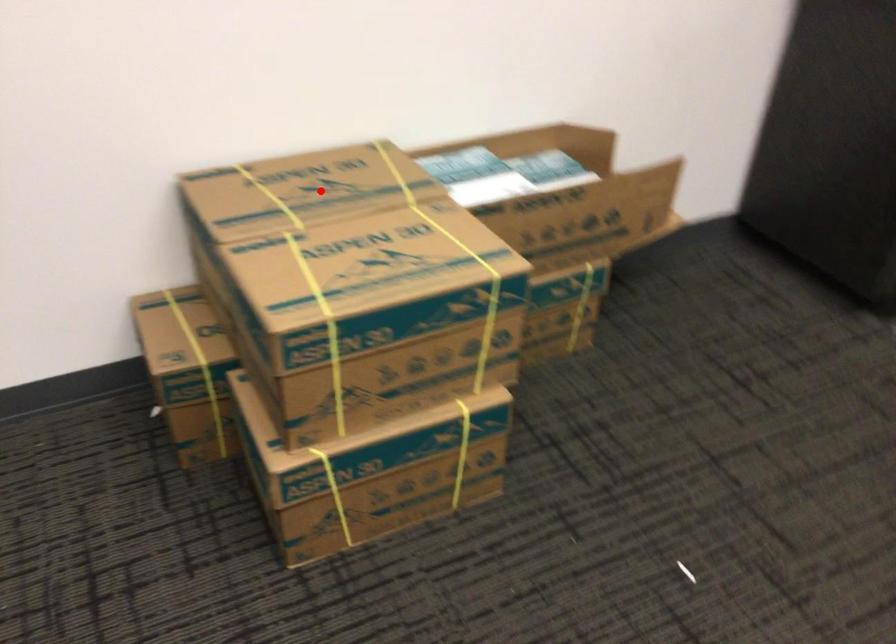
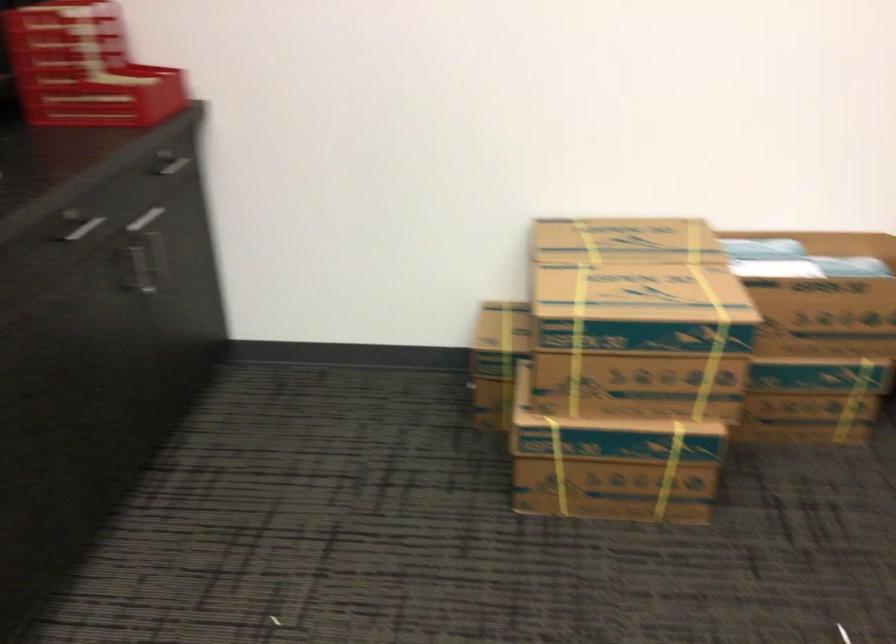
In the second image, find the point that corresponds to the highlighted location in the first image.

(624, 241)